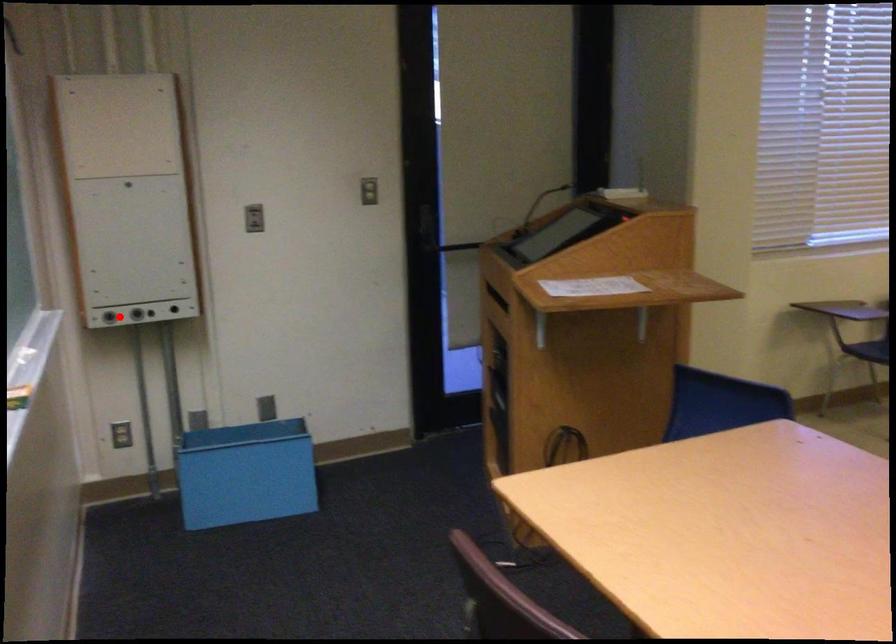
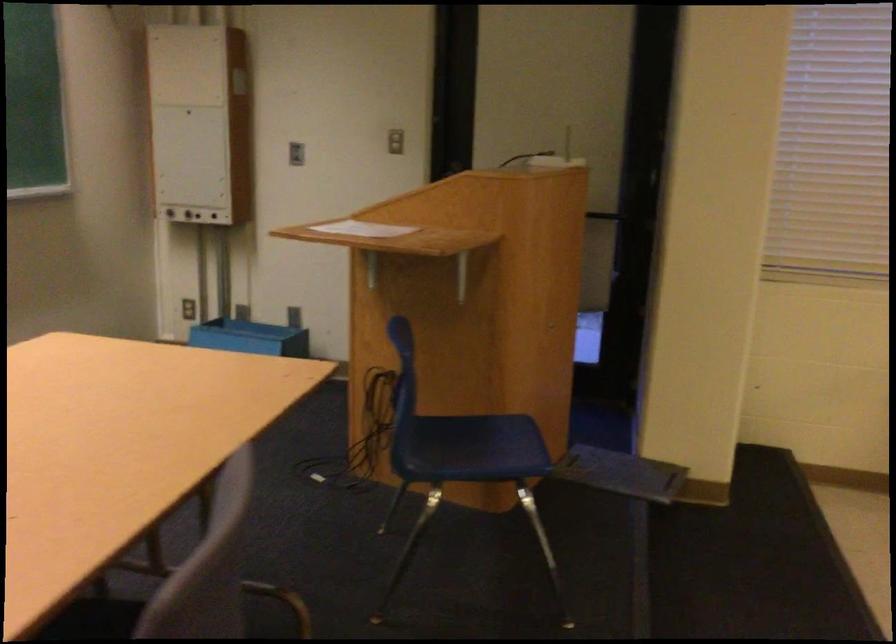
The point at the highlighted location is marked in the first image. Where is the corresponding point in the second image?

(167, 210)